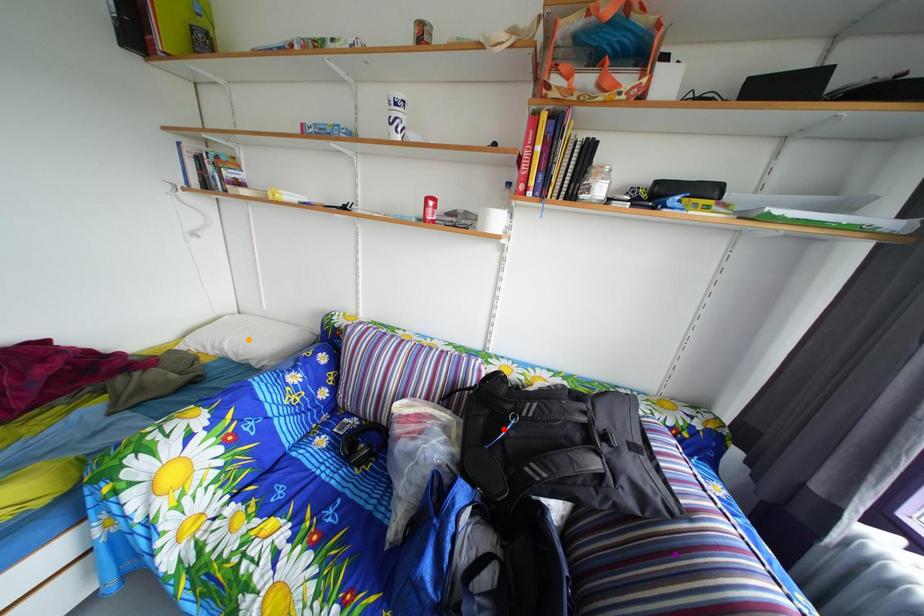
Order these from farthest to nearest:
A) purple point
B) orange point
C) red point

orange point, red point, purple point